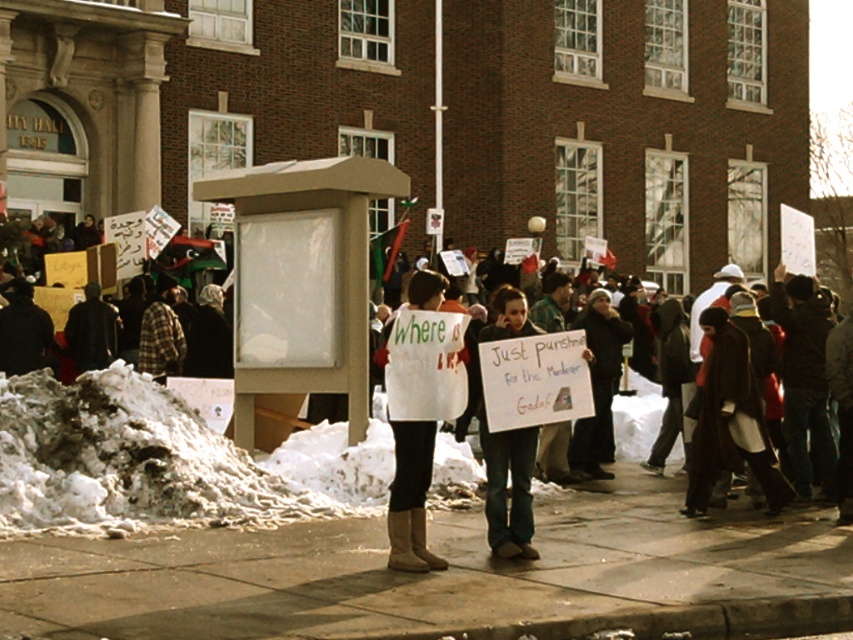
You are a photographer standing at the edge of the snow on the ground near the sidewalk. You want to take a photo of the white fabric sign at center without including the smooth concrete sidewalk at center in the frame. Is this possible?

The smooth concrete sidewalk at center is below the white fabric sign at center, so if you position yourself to focus on the upper part of the sign, you can exclude the sidewalk from the photo.

You are a photographer trying to capture the protest scene. You want to ensure the smooth concrete sidewalk at center and the white fabric sign at center are both visible in your shot. Given their sizes, which object should you focus on to ensure both are in frame without cropping?

The smooth concrete sidewalk at center is larger than the white fabric sign at center, so focusing on the sidewalk will allow both objects to fit within the frame without cropping.